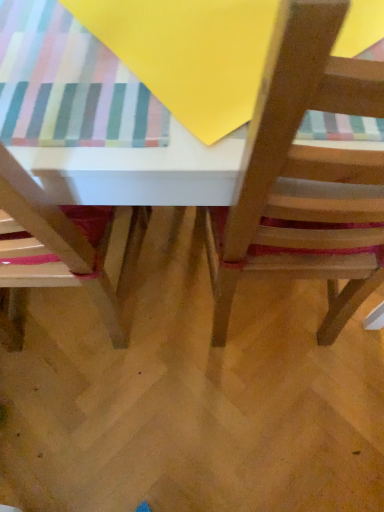
Identify the location of free space between wooden chair at lower left, which appears as the 1th chair when viewed from the left, and wooden chair at center, which is the first chair in right-to-left order. click(174, 300).